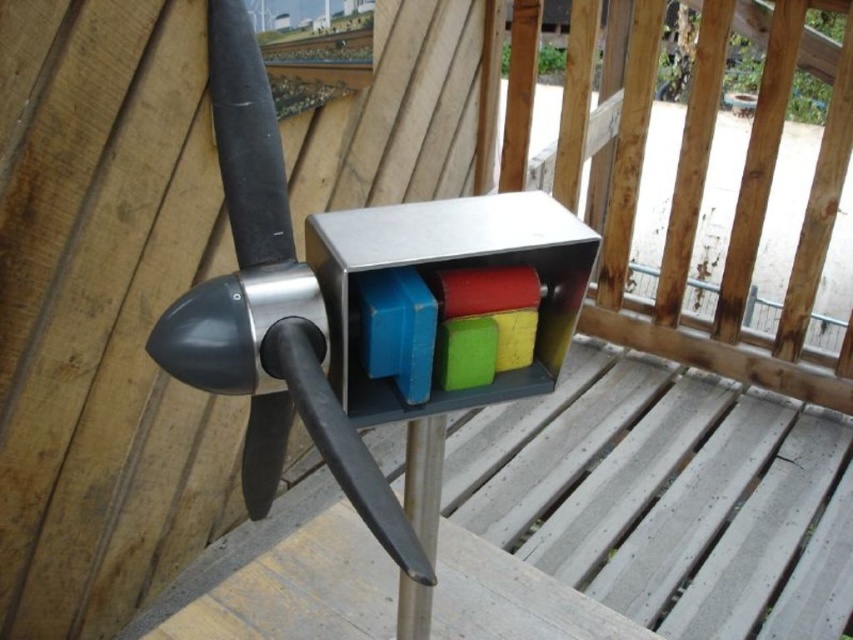
Does metallic gray propeller at center appear under polished metal propeller at center?

Yes.

This screenshot has height=640, width=853. Describe the element at coordinates (666, 497) in the screenshot. I see `metallic gray propeller at center` at that location.

Find the location of a particular element. The image size is (853, 640). metallic gray propeller at center is located at coordinates (666, 497).

Which is behind, point (811, 465) or point (403, 620)?

Positioned behind is point (811, 465).

Is metallic gray propeller at center further to the viewer compared to silver metallic pole at center?

That is True.

Between point (846, 484) and point (434, 540), which one is positioned behind?

Point (846, 484)

Locate an element on the screen. The image size is (853, 640). metallic gray propeller at center is located at coordinates (666, 497).

Does polished metal propeller at center appear on the left side of silver metallic pole at center?

Yes, polished metal propeller at center is to the left of silver metallic pole at center.

Between point (402, 552) and point (409, 464), which one is positioned behind?

Positioned behind is point (409, 464).

The image size is (853, 640). Find the location of `polished metal propeller at center`. polished metal propeller at center is located at coordinates (270, 308).